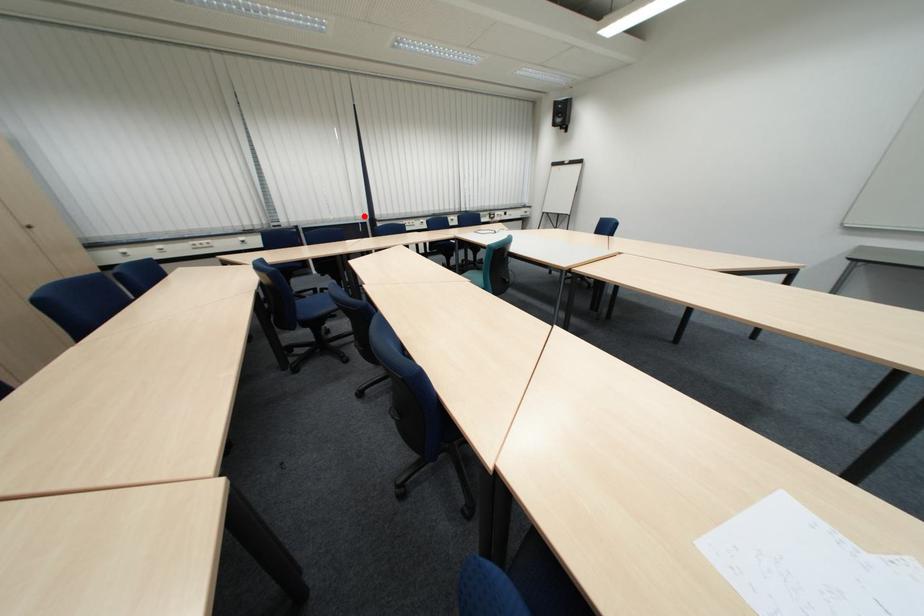
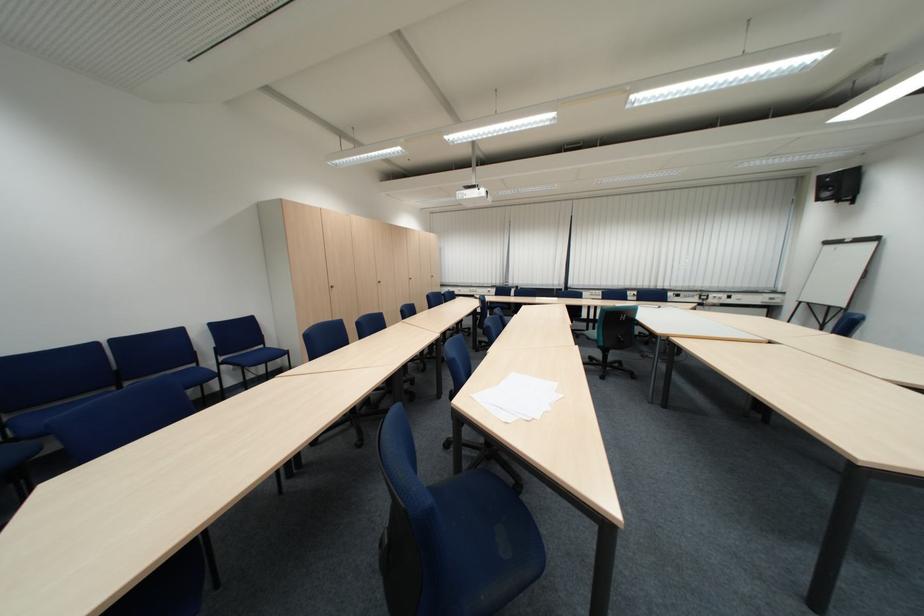
Question: I am providing you with two images of the same scene from different viewpoints. In image1, a red point is highlighted. Considering the same 3D point in image2, which of the following is correct?

Choices:
 (A) It is closer
 (B) It is farther

Answer: (B)